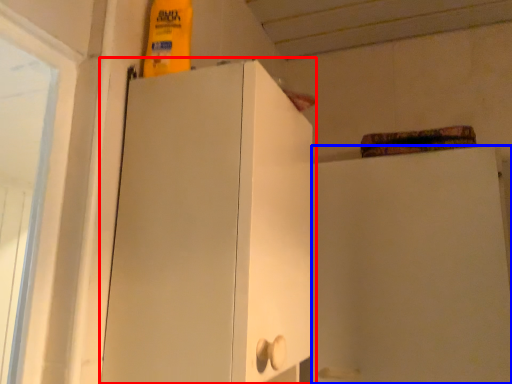
Question: Which object appears closest to the camera in this image, cupboard (highlighted by a red box) or cabinetry (highlighted by a blue box)?

Choices:
 (A) cupboard
 (B) cabinetry

Answer: (A)